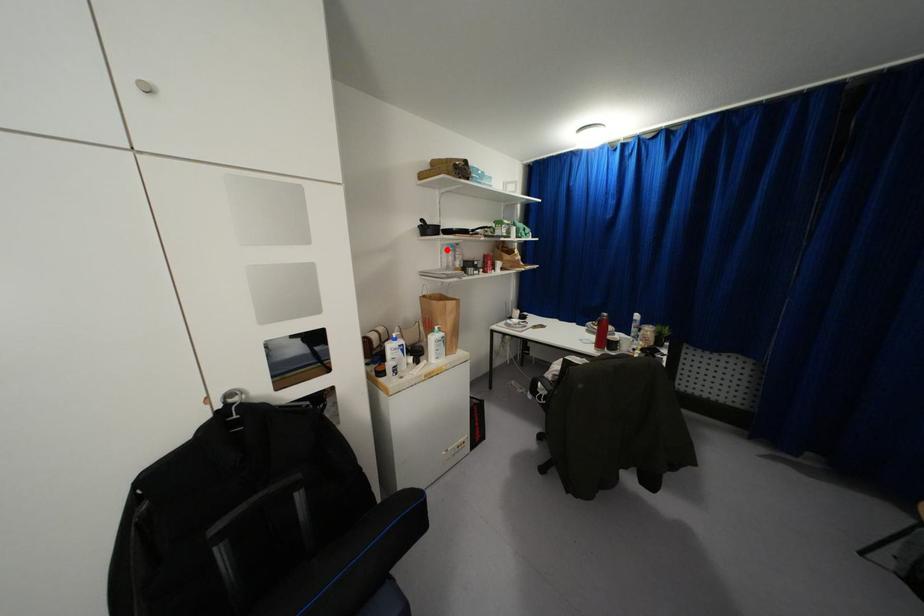
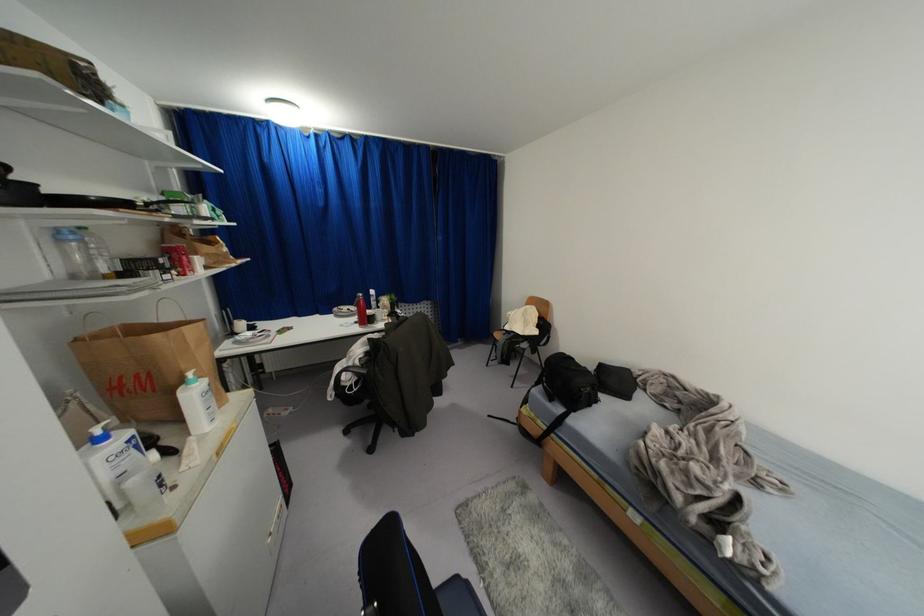
Question: I am providing you with two images of the same scene from different viewpoints. A red point is shown in image1. For the corresponding object point in image2, is it positioned nearer or farther from the camera?

Choices:
 (A) Nearer
 (B) Farther

Answer: (B)